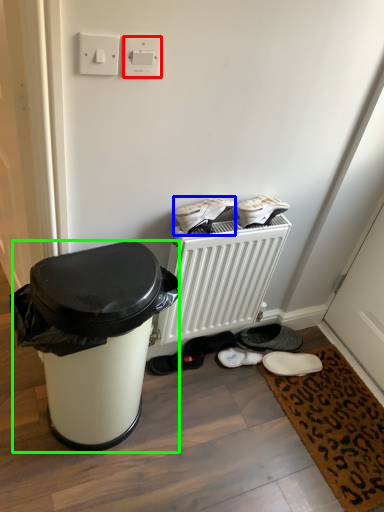
Question: Estimate the real-world distances between objects in this image. Which object is closer to electric outlet (highlighted by a red box), footwear (highlighted by a blue box) or waste container (highlighted by a green box)?

Choices:
 (A) footwear
 (B) waste container

Answer: (A)